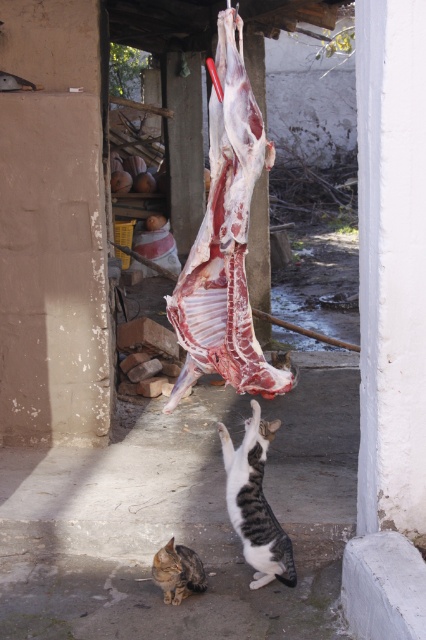
Based on the photo, you are a photographer trying to capture a photo of the tabby fur cat at center and the tabby fur cat at lower center. Since you want to focus on the cat that is closer to the camera, which one should you choose?

The tabby fur cat at center is much taller than the tabby fur cat at lower center, so it is closer to the camera. Therefore, you should focus on the tabby fur cat at center.

You are a cat owner who wants to ensure your cats can safely interact with the hanging meat. Given that the distance between the tabby fur cat at center and the tabby fur cat at lower center is 28.45 centimeters, what is the minimum space required between the cats to prevent them from bumping into each other while moving around?

The minimum space required between the tabby fur cat at center and the tabby fur cat at lower center to prevent bumping is at least 28.45 centimeters, as they are currently 28.45 centimeters apart.

You are a photographer trying to capture a photo of both cats. Since the tabby fur cat at center and the tabby fur cat at lower center are positioned in a way that one is above the other, will you need to adjust your camera angle to ensure both are fully visible in the photo?

The tabby fur cat at center is above the tabby fur cat at lower center. To ensure both are fully visible, you may need to adjust your camera angle to capture both positions.